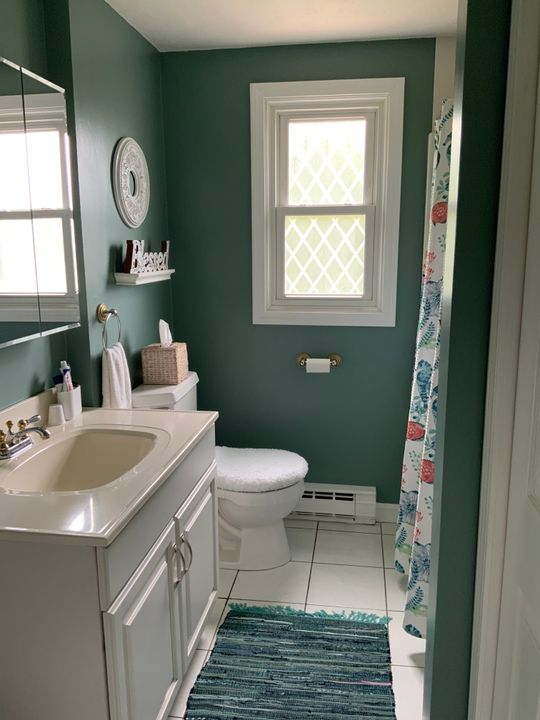
Find the location of a particular element. This screenshot has width=540, height=720. 1 type of tile on floor is located at coordinates (349, 582).